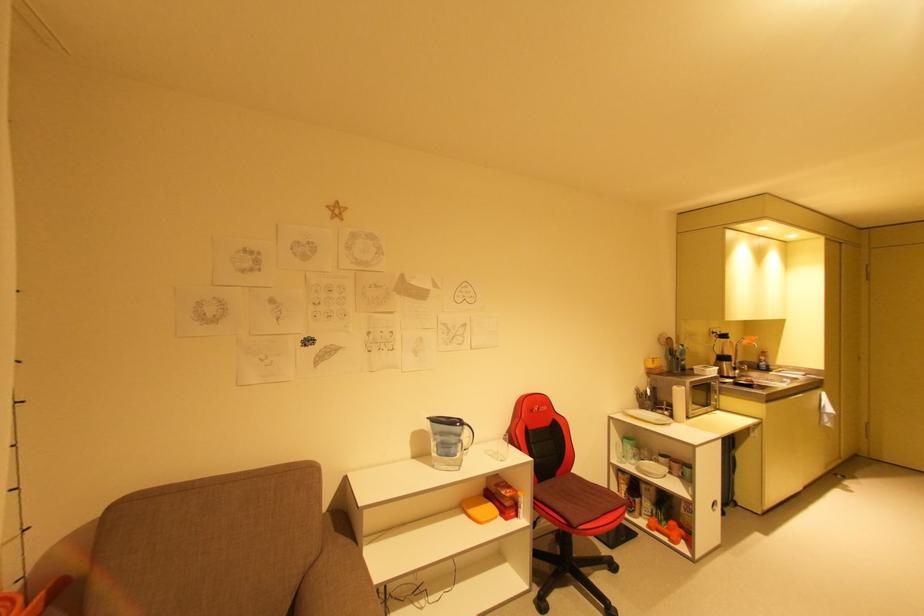
Where would you pull the silver microwave handle? Please return your answer as a coordinate pair (x, y).

(686, 390)